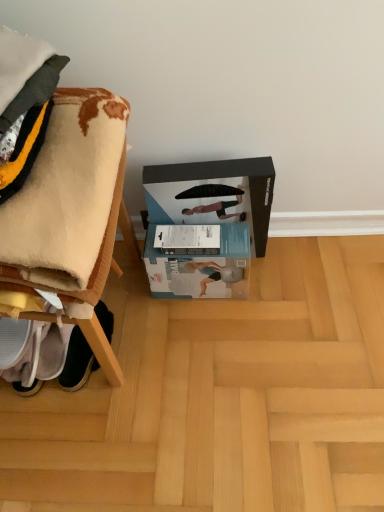
Where is `vacant point above light brown wood at lower center (from a real-world perspective)`? vacant point above light brown wood at lower center (from a real-world perspective) is located at coordinates (233, 365).